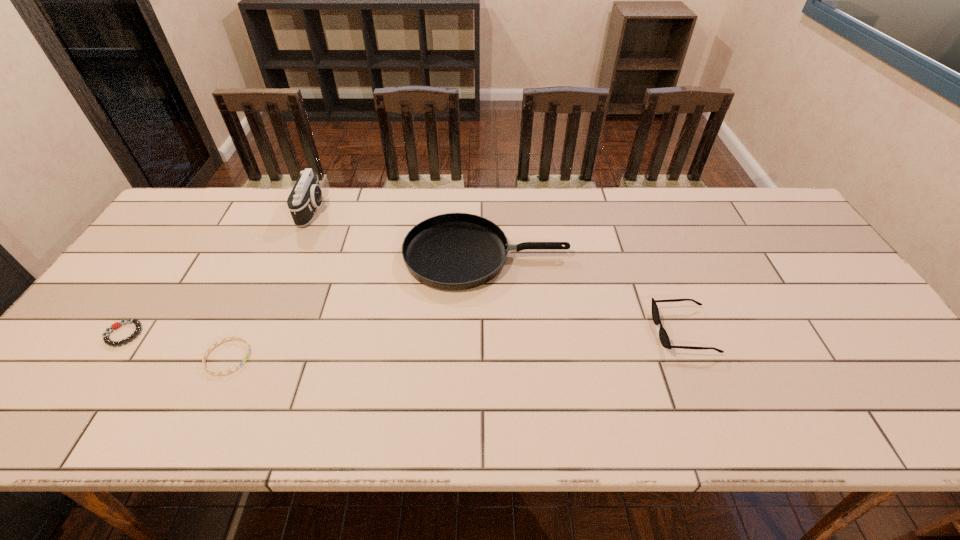
Find the location of a particular element. The height and width of the screenshot is (540, 960). blank space located 0.310m on the surface of the right bracelet showing star-shaped elements is located at coordinates (381, 357).

Image resolution: width=960 pixels, height=540 pixels. In order to click on free spot located 0.060m on the right of the left bracelet in this screenshot , I will do pos(166,334).

The width and height of the screenshot is (960, 540). Find the location of `camera at the far edge`. camera at the far edge is located at coordinates (306, 196).

This screenshot has height=540, width=960. I want to click on frying pan that is at the far edge, so click(453, 251).

The height and width of the screenshot is (540, 960). Identify the location of object that is at the left edge. (137, 323).

Locate an element on the screen. The width and height of the screenshot is (960, 540). vacant space at the far edge of the desktop is located at coordinates (544, 221).

Image resolution: width=960 pixels, height=540 pixels. Find the location of `vacant area at the near edge`. vacant area at the near edge is located at coordinates (817, 407).

This screenshot has height=540, width=960. What are the coordinates of `blank area at the left edge` in the screenshot? It's located at (99, 352).

Where is `free space at the right edge of the desktop`? free space at the right edge of the desktop is located at coordinates (908, 394).

You are a GUI agent. You are given a task and a screenshot of the screen. Output one action in this format:
    pyautogui.click(x=<x>, y=<y>)
    Task: Click on the free space at the far left corner of the desktop
    The height and width of the screenshot is (540, 960).
    Given the screenshot: What is the action you would take?
    pyautogui.click(x=228, y=207)